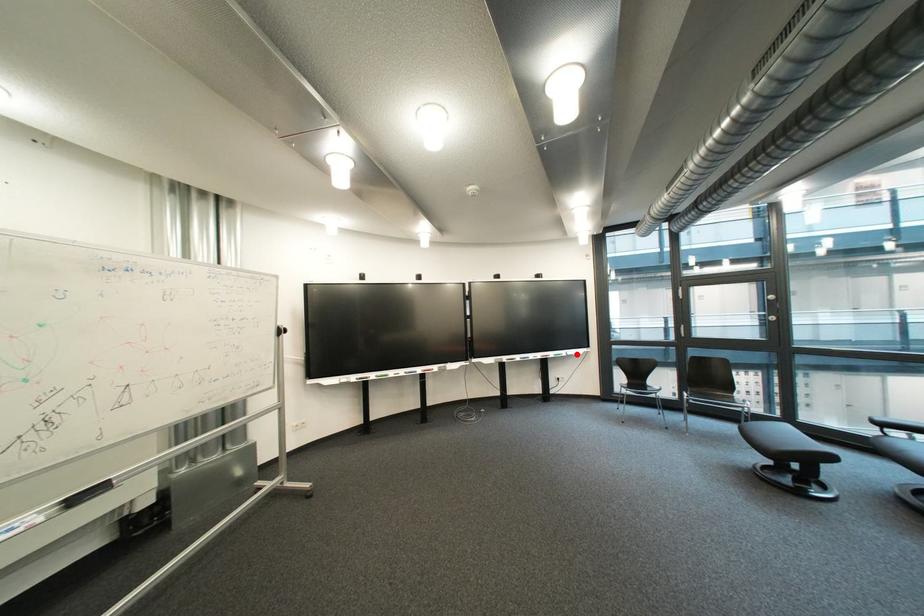
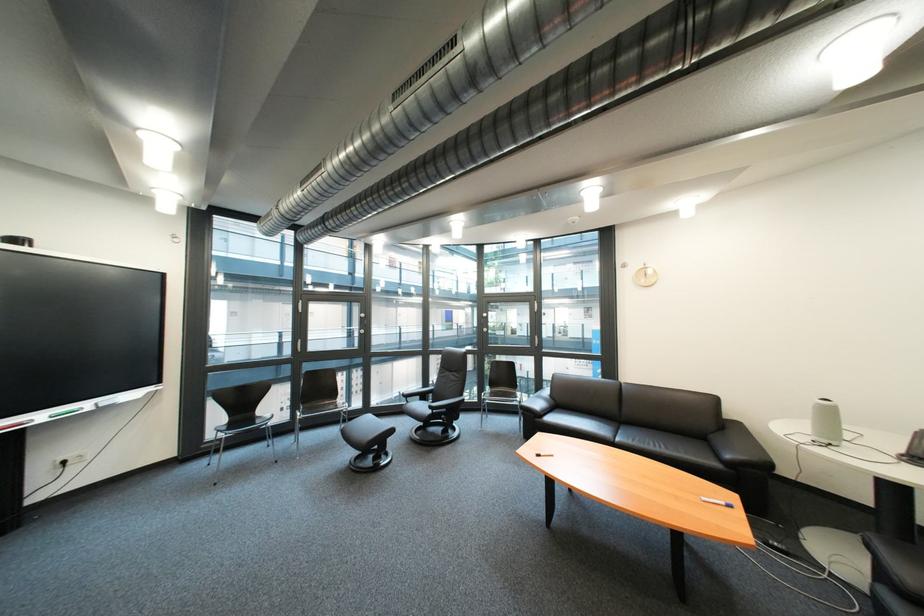
Where in the second image is the point corresponding to the highlighted location from the first image?

(101, 406)